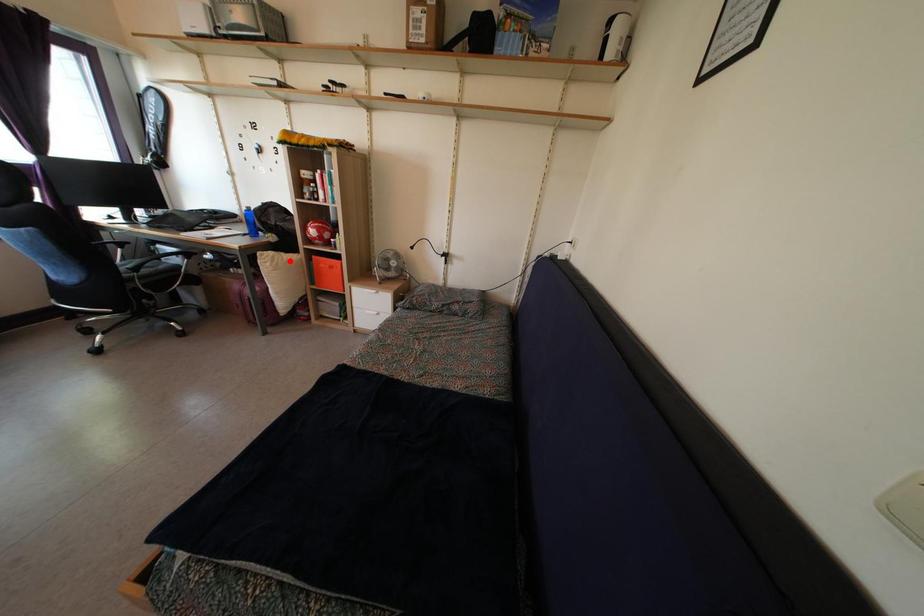
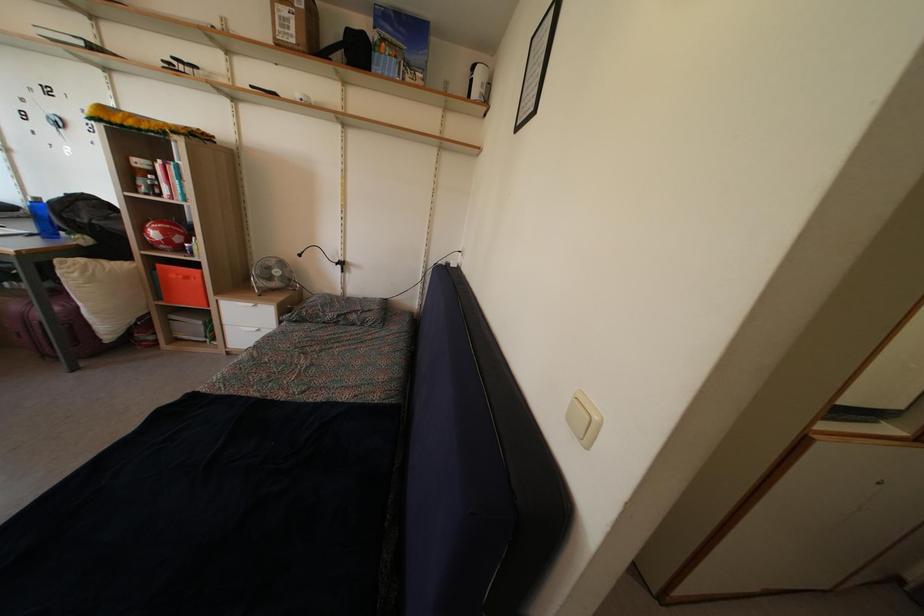
The point at the highlighted location is marked in the first image. Where is the corresponding point in the second image?

(116, 268)